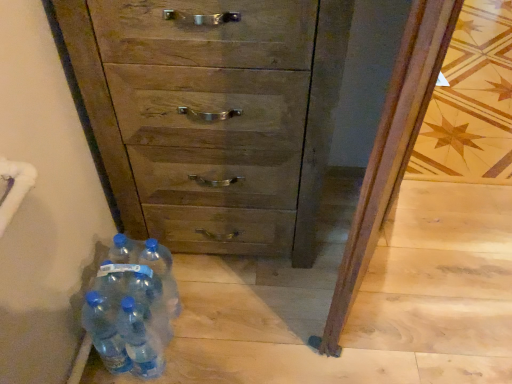
Where is `vacant area on the back side of blue translucent bottle at lower left, acting as the 1th bottle starting from the right`? Image resolution: width=512 pixels, height=384 pixels. vacant area on the back side of blue translucent bottle at lower left, acting as the 1th bottle starting from the right is located at coordinates (193, 271).